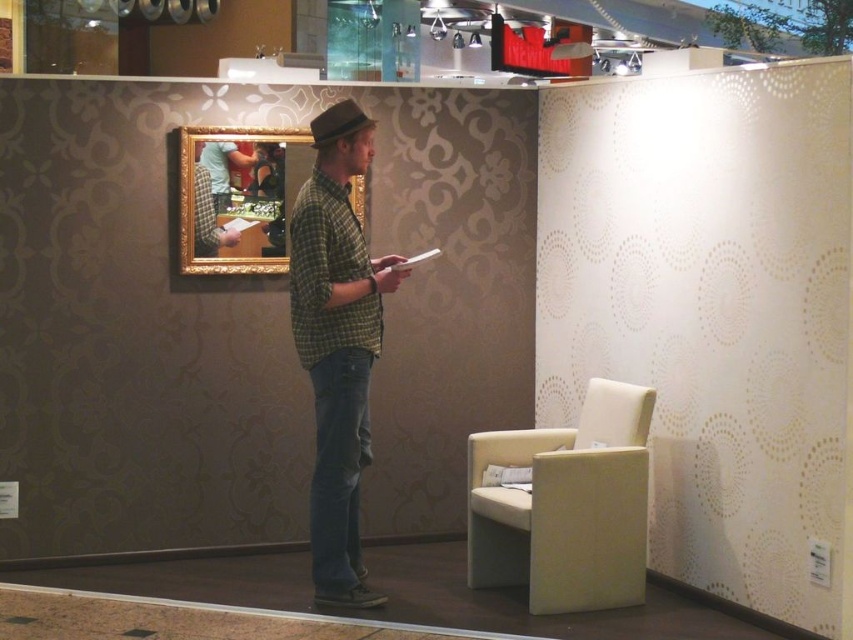
You are standing in the showroom and want to move from point (543, 538) to point (367, 125). Since both points are in the image, which direction should you move to get closer to your destination?

To move from point (543, 538) to point (367, 125), you should move towards the direction of the point (367, 125), which is closer to the viewer. Since point (543, 538) is further away, moving towards the viewer would bring you closer to the destination.

You are a delivery person trying to place a large package that is 1 meter wide in this room. You see the beige fabric armchair at lower right and the brown felt fedora at center. Which object has a larger width, and can the package fit between them if they are positioned side by side?

The beige fabric armchair at lower right has a larger width than the brown felt fedora at center. Since the package is 1 meter wide, and the combined width of both objects is greater than 1 meter, the package cannot fit between them when placed side by side.

From the picture: You are standing in the showroom and want to sit down. There is a beige fabric armchair at lower right. Can you estimate its position in the room using coordinates?

The beige fabric armchair at lower right is located at coordinates point [566,506].